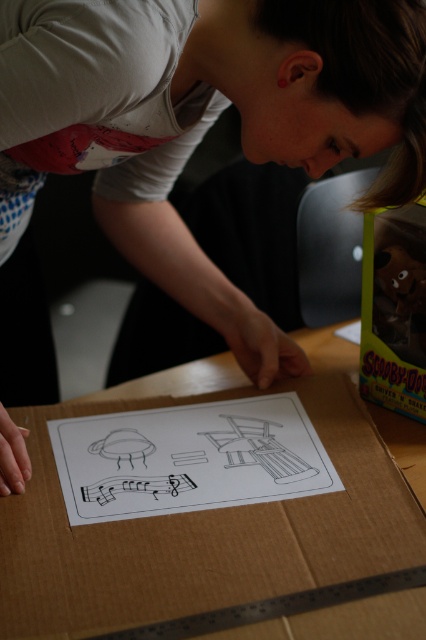
Which is behind, point (290, 548) or point (400, 365)?

The point (400, 365) is behind.

Is brown cardboard box at center to the left of translucent plastic toy at upper right from the viewer's perspective?

Indeed, brown cardboard box at center is positioned on the left side of translucent plastic toy at upper right.

This screenshot has width=426, height=640. I want to click on brown cardboard box at center, so click(x=210, y=538).